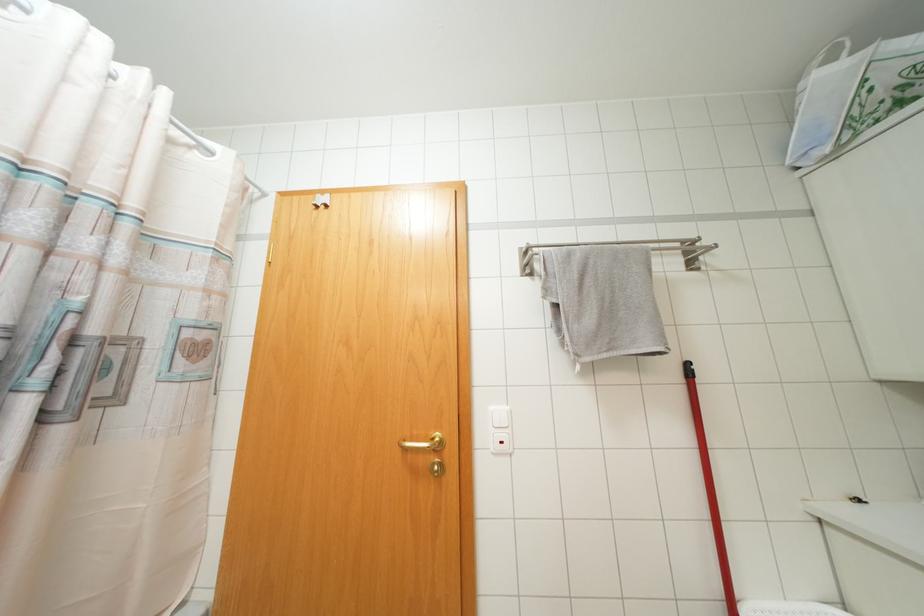
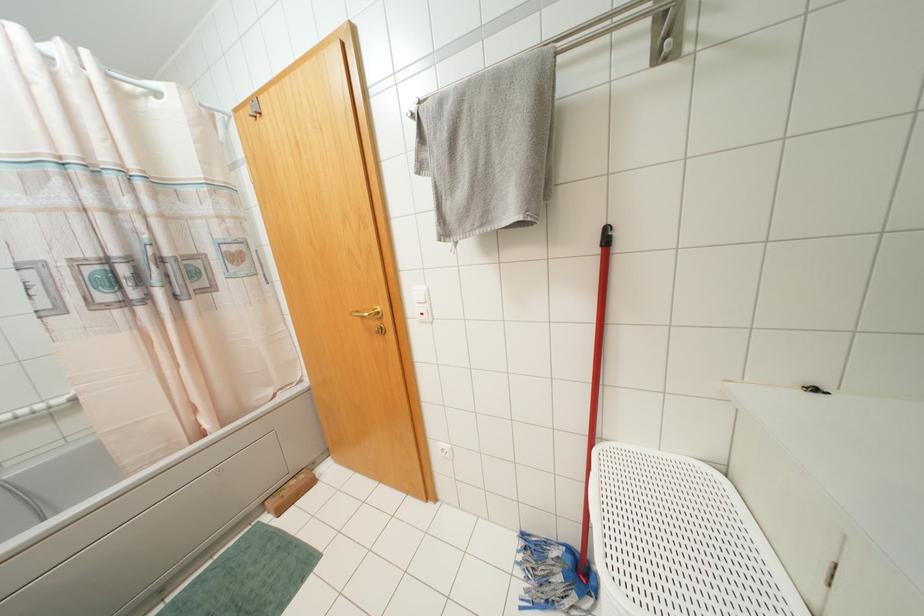
Locate, in the second image, the point that corresponds to [686,363] in the first image.

(606, 229)